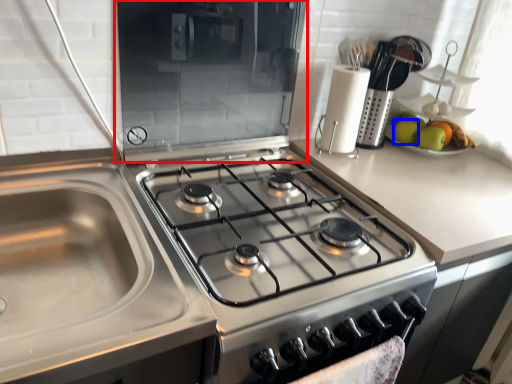
Question: Which object is closer to the camera taking this photo, appliance (highlighted by a red box) or apple (highlighted by a blue box)?

Choices:
 (A) appliance
 (B) apple

Answer: (A)